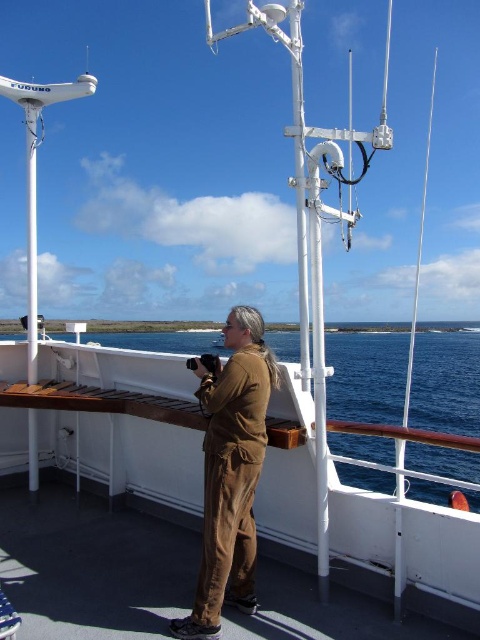
You are a photographer on the ship deck. You notice the blue water at center and the brown corduroy pants at center. Which object is taller in the image?

The blue water at center is taller than the brown corduroy pants at center according to the description.

Based on the photo, you are on a ship and want to take a photo of the blue water at center without the brown corduroy pants at center blocking the view. Where should you move to ensure the pants are out of frame?

The blue water at center is positioned under the brown corduroy pants at center, so moving to the side or backward would position the pants out of the frame.

You are a photographer on the deck of a ship. You notice the blue water at center and the brown corduroy pants at center in your viewfinder. Which object takes up more space in your current frame?

The blue water at center takes up more space in the frame because it is bigger than the brown corduroy pants at center.